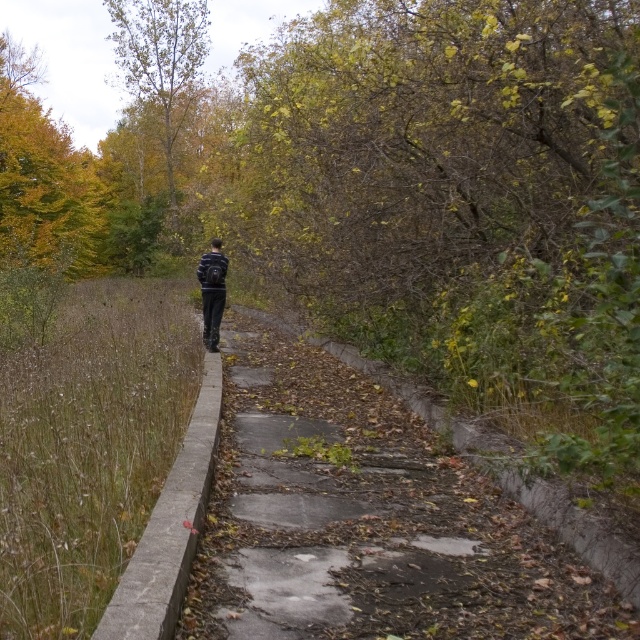
Question: Which point is closer to the camera taking this photo?

Choices:
 (A) (218, 257)
 (B) (532, 561)
 (C) (176, 134)
 (D) (196, 266)

Answer: (B)

Question: Considering the real-world distances, which object is farthest from the striped sweater at center?

Choices:
 (A) concrete at center
 (B) dark blue fabric jacket at center

Answer: (A)

Question: Which object is the farthest from the green leafy tree at upper left?

Choices:
 (A) dark blue fabric jacket at center
 (B) striped sweater at center
 (C) concrete at center

Answer: (C)

Question: Is green leafy tree at upper left to the left of striped sweater at center from the viewer's perspective?

Choices:
 (A) yes
 (B) no

Answer: (A)

Question: Can you confirm if concrete at center is wider than dark blue fabric jacket at center?

Choices:
 (A) yes
 (B) no

Answer: (A)

Question: Does green leafy tree at upper left appear under striped sweater at center?

Choices:
 (A) no
 (B) yes

Answer: (A)